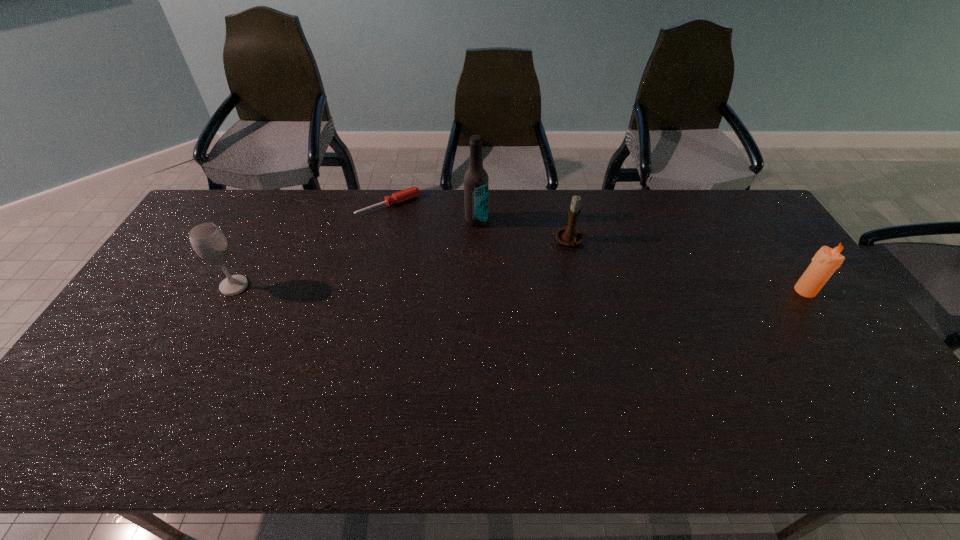
Image resolution: width=960 pixels, height=540 pixels. What are the coordinates of `candle holder located in the far edge section of the desktop` in the screenshot? It's located at (570, 236).

The height and width of the screenshot is (540, 960). I want to click on screwdriver that is at the far edge, so click(412, 192).

Where is `object that is at the right edge`? The height and width of the screenshot is (540, 960). object that is at the right edge is located at coordinates pos(825,262).

At what (x,y) coordinates should I click in order to perform the action: click on free region at the far edge of the desktop. Please return your answer as a coordinate pair (x, y). Looking at the image, I should click on (582, 224).

You are a GUI agent. You are given a task and a screenshot of the screen. Output one action in this format:
    pyautogui.click(x=<x>, y=<y>)
    Task: Click on the vacant space at the near edge
    
    Given the screenshot: What is the action you would take?
    pyautogui.click(x=693, y=375)

The height and width of the screenshot is (540, 960). I want to click on free space at the left edge of the desktop, so click(200, 280).

This screenshot has width=960, height=540. In the image, there is a desktop. Find the location of `vacant space at the right edge`. vacant space at the right edge is located at coordinates (828, 339).

Identify the location of vacant region at the near left corner of the desktop. The image size is (960, 540). 133,380.

Locate an element on the screen. This screenshot has height=540, width=960. free space that is in between the candle and the fourth object from left to right is located at coordinates (687, 266).

Where is `free space between the third farthest object and the beer bottle`? Image resolution: width=960 pixels, height=540 pixels. free space between the third farthest object and the beer bottle is located at coordinates (523, 231).